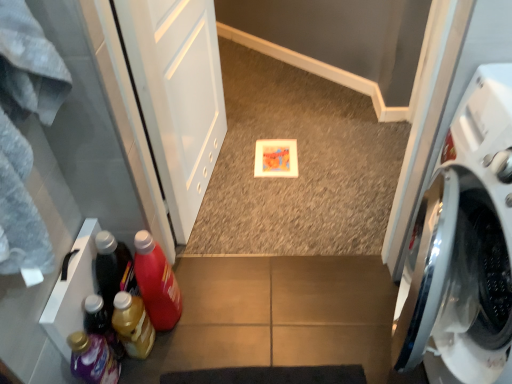
Based on the photo, measure the distance between matte plastic bottle at lower left, positioned as the fourth bottle in left-to-right order, and camera.

matte plastic bottle at lower left, positioned as the fourth bottle in left-to-right order, is 4.26 feet from camera.

What do you see at coordinates (156, 282) in the screenshot? I see `matte plastic bottle at lower left, which is counted as the 1th bottle, starting from the right` at bounding box center [156, 282].

This screenshot has height=384, width=512. Describe the element at coordinates (177, 95) in the screenshot. I see `white glossy screen door at upper left` at that location.

This screenshot has height=384, width=512. In order to click on translucent plastic bottle at lower left, which is the second bottle from left to right in this screenshot , I will do `click(101, 323)`.

What is the approximate width of white glossy washing machine at right?

white glossy washing machine at right is 23.24 inches wide.

Find the location of a particular element. matte plastic bottle at lower left, positioned as the fourth bottle in left-to-right order is located at coordinates (156, 282).

Is white glossy washing machine at right to the left of translucent yellow bottle at lower left, which is the 2th bottle from right to left, from the viewer's perspective?

No.

Does point (494, 380) appear closer or farther from the camera than point (137, 343)?

Point (494, 380) is closer to the camera than point (137, 343).

Starting from the white glossy washing machine at right, which bottle is the 2nd one behind? Please provide its 2D coordinates.

[(133, 325)]

From a real-world perspective, is white glossy washing machine at right over translucent yellow bottle at lower left, which is the 2th bottle from right to left?

Yes.

Does point (437, 249) come behind point (89, 331)?

No, it is in front of (89, 331).

How many degrees apart are the facing directions of white glossy washing machine at right and translucent plastic bottle at lower left, which is the second bottle from left to right?

There is a 178-degree angle between the facing directions of white glossy washing machine at right and translucent plastic bottle at lower left, which is the second bottle from left to right.

From the image's perspective, which is above, white glossy washing machine at right or translucent plastic bottle at lower left, which is the second bottle from left to right?

white glossy washing machine at right.

Is white glossy washing machine at right shorter than translucent plastic bottle at lower left, the 3th bottle from the right?

No, white glossy washing machine at right is not shorter than translucent plastic bottle at lower left, the 3th bottle from the right.

Is matte plastic bottle at lower left, which is counted as the 1th bottle, starting from the right, looking in the opposite direction of translucent yellow bottle at lower left, which is the 2th bottle from right to left?

No, translucent yellow bottle at lower left, which is the 2th bottle from right to left, is not at the back of matte plastic bottle at lower left, which is counted as the 1th bottle, starting from the right.

Would you say matte plastic bottle at lower left, positioned as the fourth bottle in left-to-right order, is inside or outside translucent yellow bottle at lower left, the 3th bottle when ordered from left to right?

matte plastic bottle at lower left, positioned as the fourth bottle in left-to-right order, lies outside translucent yellow bottle at lower left, the 3th bottle when ordered from left to right.

This screenshot has height=384, width=512. What are the coordinates of `the 1st bottle behind the translucent yellow bottle at lower left, the 3th bottle when ordered from left to right` in the screenshot? It's located at (156, 282).

From the image's perspective, which one is positioned lower, white glossy screen door at upper left or white glossy washing machine at right?

white glossy washing machine at right is shown below in the image.

Is white glossy washing machine at right a part of white glossy screen door at upper left?

No, white glossy washing machine at right is not surrounded by white glossy screen door at upper left.

Is there a large distance between white glossy screen door at upper left and white glossy washing machine at right?

white glossy screen door at upper left is near white glossy washing machine at right, not far away.

Could you measure the distance between white glossy screen door at upper left and white glossy washing machine at right?

white glossy screen door at upper left and white glossy washing machine at right are 36.77 inches apart from each other.

From the picture: From a real-world perspective, is white glossy washing machine at right positioned over translucent plastic detergent at lower left, which ranks as the 4th bottle in right-to-left order, based on gravity?

Correct, in the physical world, white glossy washing machine at right is higher than translucent plastic detergent at lower left, which ranks as the 4th bottle in right-to-left order.

At what (x,y) coordinates should I click in order to perform the action: click on washing machine to the right of translucent plastic detergent at lower left, acting as the 1th bottle starting from the left. Please return your answer as a coordinate pair (x, y). Image resolution: width=512 pixels, height=384 pixels. Looking at the image, I should click on (463, 244).

How different are the orientations of white glossy washing machine at right and translucent plastic detergent at lower left, acting as the 1th bottle starting from the left, in degrees?

white glossy washing machine at right and translucent plastic detergent at lower left, acting as the 1th bottle starting from the left, are facing 167 degrees away from each other.

Would you say white glossy washing machine at right is a long distance from translucent plastic detergent at lower left, acting as the 1th bottle starting from the left?

No.

From a real-world perspective, is white glossy washing machine at right positioned over matte plastic bottle at lower left, which is counted as the 1th bottle, starting from the right, based on gravity?

Indeed, from a real-world perspective, white glossy washing machine at right stands above matte plastic bottle at lower left, which is counted as the 1th bottle, starting from the right.

Does white glossy washing machine at right have a lesser height compared to matte plastic bottle at lower left, positioned as the fourth bottle in left-to-right order?

No.

From the image's perspective, relative to matte plastic bottle at lower left, which is counted as the 1th bottle, starting from the right, is white glossy washing machine at right above or below?

white glossy washing machine at right is above matte plastic bottle at lower left, which is counted as the 1th bottle, starting from the right.

Which point is more forward, (x=490, y=316) or (x=141, y=272)?

The point (x=490, y=316) is closer to the camera.

Considering the sizes of objects white glossy screen door at upper left and translucent yellow bottle at lower left, the 3th bottle when ordered from left to right, in the image provided, who is shorter, white glossy screen door at upper left or translucent yellow bottle at lower left, the 3th bottle when ordered from left to right,?

Standing shorter between the two is translucent yellow bottle at lower left, the 3th bottle when ordered from left to right.

Which is further, (206, 184) or (129, 328)?

Point (206, 184)

Identify the location of bottle that is the 2nd object to the left of the white glossy screen door at upper left, starting at the anchor. The width and height of the screenshot is (512, 384). (133, 325).

Considering the relative positions of white glossy screen door at upper left and translucent yellow bottle at lower left, the 3th bottle when ordered from left to right, in the image provided, is white glossy screen door at upper left to the right of translucent yellow bottle at lower left, the 3th bottle when ordered from left to right, from the viewer's perspective?

Correct, you'll find white glossy screen door at upper left to the right of translucent yellow bottle at lower left, the 3th bottle when ordered from left to right.

Which bottle is the 2nd one when counting from the left side of the white glossy washing machine at right? Please provide its 2D coordinates.

[(133, 325)]

The height and width of the screenshot is (384, 512). In order to click on bottle that is the 4th object located behind the white glossy washing machine at right in this screenshot , I will do `click(101, 323)`.

Considering their positions, is matte plastic bottle at lower left, positioned as the fourth bottle in left-to-right order, positioned further to white glossy screen door at upper left than translucent yellow bottle at lower left, the 3th bottle when ordered from left to right?

Among the two, translucent yellow bottle at lower left, the 3th bottle when ordered from left to right, is located further to white glossy screen door at upper left.

Which object lies further to the anchor point translucent yellow bottle at lower left, the 3th bottle when ordered from left to right, white glossy washing machine at right or matte plastic bottle at lower left, positioned as the fourth bottle in left-to-right order?

The object further to translucent yellow bottle at lower left, the 3th bottle when ordered from left to right, is white glossy washing machine at right.

From the picture: Estimate the real-world distances between objects in this image. Which object is further from matte plastic bottle at lower left, which is counted as the 1th bottle, starting from the right, translucent plastic bottle at lower left, the 3th bottle from the right, or translucent plastic detergent at lower left, acting as the 1th bottle starting from the left?

Among the two, translucent plastic detergent at lower left, acting as the 1th bottle starting from the left, is located further to matte plastic bottle at lower left, which is counted as the 1th bottle, starting from the right.

Based on their spatial positions, is translucent plastic detergent at lower left, which ranks as the 4th bottle in right-to-left order, or matte plastic bottle at lower left, which is counted as the 1th bottle, starting from the right, further from white glossy screen door at upper left?

translucent plastic detergent at lower left, which ranks as the 4th bottle in right-to-left order, is positioned further to the anchor white glossy screen door at upper left.

When comparing their distances from matte plastic bottle at lower left, which is counted as the 1th bottle, starting from the right, does translucent yellow bottle at lower left, the 3th bottle when ordered from left to right, or white glossy washing machine at right seem further?

Among the two, white glossy washing machine at right is located further to matte plastic bottle at lower left, which is counted as the 1th bottle, starting from the right.

Based on their spatial positions, is white glossy screen door at upper left or translucent plastic detergent at lower left, acting as the 1th bottle starting from the left, closer to translucent plastic bottle at lower left, the 3th bottle from the right?

The object closer to translucent plastic bottle at lower left, the 3th bottle from the right, is translucent plastic detergent at lower left, acting as the 1th bottle starting from the left.

When comparing their distances from white glossy screen door at upper left, does translucent plastic bottle at lower left, which is the second bottle from left to right, or white glossy washing machine at right seem further?

white glossy washing machine at right is further to white glossy screen door at upper left.

Based on their spatial positions, is matte plastic bottle at lower left, positioned as the fourth bottle in left-to-right order, or white glossy washing machine at right further from translucent yellow bottle at lower left, the 3th bottle when ordered from left to right?

The object further to translucent yellow bottle at lower left, the 3th bottle when ordered from left to right, is white glossy washing machine at right.

Find the location of a particular element. This screenshot has height=384, width=512. bottle between translucent yellow bottle at lower left, which is the 2th bottle from right to left, and white glossy washing machine at right from left to right is located at coordinates (156, 282).

You are a GUI agent. You are given a task and a screenshot of the screen. Output one action in this format:
    pyautogui.click(x=<x>, y=<y>)
    Task: Click on the bottle between matte plastic bottle at lower left, which is counted as the 1th bottle, starting from the right, and translucent plastic bottle at lower left, the 3th bottle from the right, in the vertical direction
    Image resolution: width=512 pixels, height=384 pixels.
    Given the screenshot: What is the action you would take?
    [133, 325]

Find the location of `bottle that lies between white glossy screen door at upper left and translucent yellow bottle at lower left, the 3th bottle when ordered from left to right, from top to bottom`. bottle that lies between white glossy screen door at upper left and translucent yellow bottle at lower left, the 3th bottle when ordered from left to right, from top to bottom is located at coordinates (156, 282).

Where is `screen door situated between translucent plastic bottle at lower left, which is the second bottle from left to right, and white glossy washing machine at right from left to right`? Image resolution: width=512 pixels, height=384 pixels. screen door situated between translucent plastic bottle at lower left, which is the second bottle from left to right, and white glossy washing machine at right from left to right is located at coordinates (177, 95).